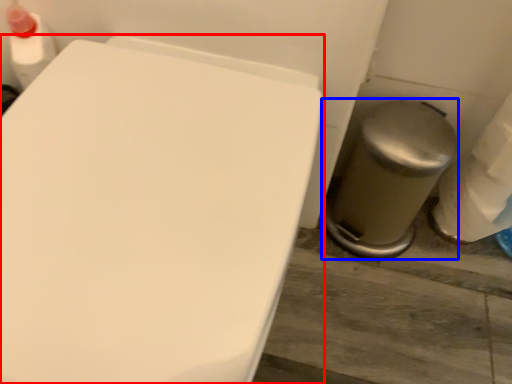
Question: Which point is further to the camera, toilet (highlighted by a red box) or porcelain (highlighted by a blue box)?

Choices:
 (A) toilet
 (B) porcelain

Answer: (B)